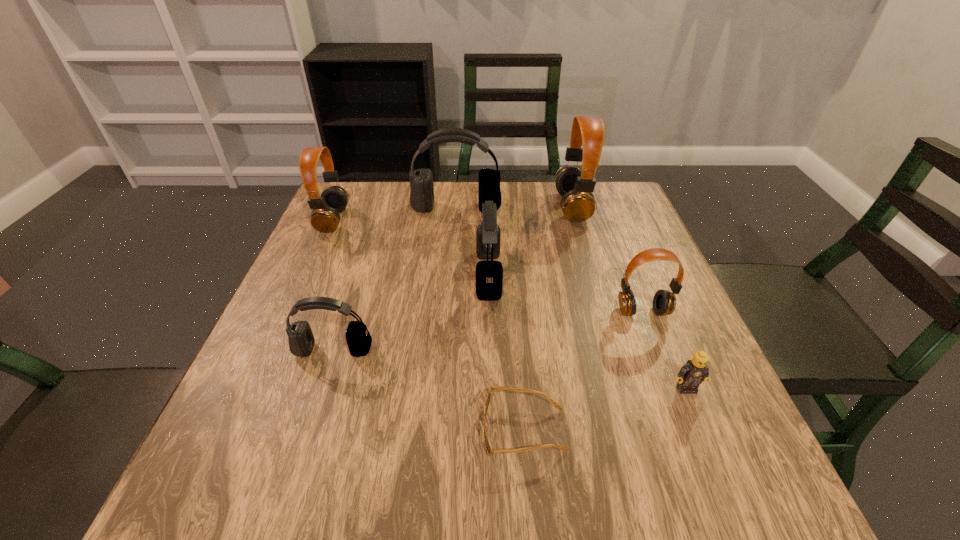
Select which brown headset is the third closest to the sunglasses. Please provide its 2D coordinates. Your answer should be formatted as a tuple, i.e. [(x, y)], where the tuple contains the x and y coordinates of a point satisfying the conditions above.

[(325, 217)]

Select which black headset is the second closest to the shortest object. Please provide its 2D coordinates. Your answer should be formatted as a tuple, i.e. [(x, y)], where the tuple contains the x and y coordinates of a point satisfying the conditions above.

[(489, 274)]

Identify which black headset is located as the second nearest to the leftmost object. Please provide its 2D coordinates. Your answer should be formatted as a tuple, i.e. [(x, y)], where the tuple contains the x and y coordinates of a point satisfying the conditions above.

[(301, 340)]

Find the location of `blank area in the image that satisfies the following two spatial constraints: 1. on the ear cups of the biggest brown headset; 2. on the headband of the leftmost black headset`. blank area in the image that satisfies the following two spatial constraints: 1. on the ear cups of the biggest brown headset; 2. on the headband of the leftmost black headset is located at coordinates (614, 350).